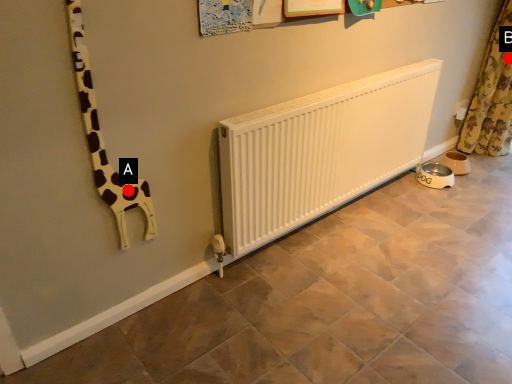
Question: Two points are circled on the image, labeled by A and B beside each circle. Which of the following is the farthest from the observer?

Choices:
 (A) A is further
 (B) B is further

Answer: (B)